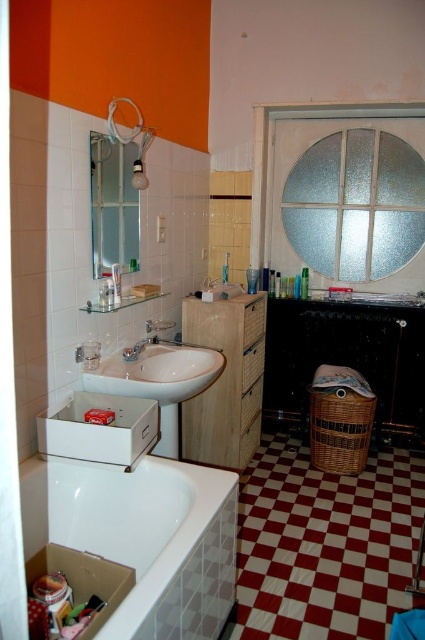
You are standing in the bathroom and want to reach both the point at (263, 307) and the point at (96, 388). Which point will require you to stretch more to reach?

The point at (263, 307) is further to the camera than the point at (96, 388), so you will need to stretch more to reach the point at (263, 307).

You are standing in the bathroom and want to take a shower. Which object should you approach first, the white glossy bathtub at lower left or the matte white shower at upper left?

You should approach the matte white shower at upper left first because it is farther away from you than the white glossy bathtub at lower left, so you need to move towards it before reaching the bathtub.

You are a home inspector assessing the bathroom layout. You need to determine if the wooden cabinet at center can be moved to the location currently occupied by the white glossy sink at center. Based on their sizes, is this feasible?

The wooden cabinet at center is much taller than the white glossy sink at center. Moving the cabinet to the sink location might not be feasible due to its greater height, which could obstruct the space above or require adjustments to accommodate its size.